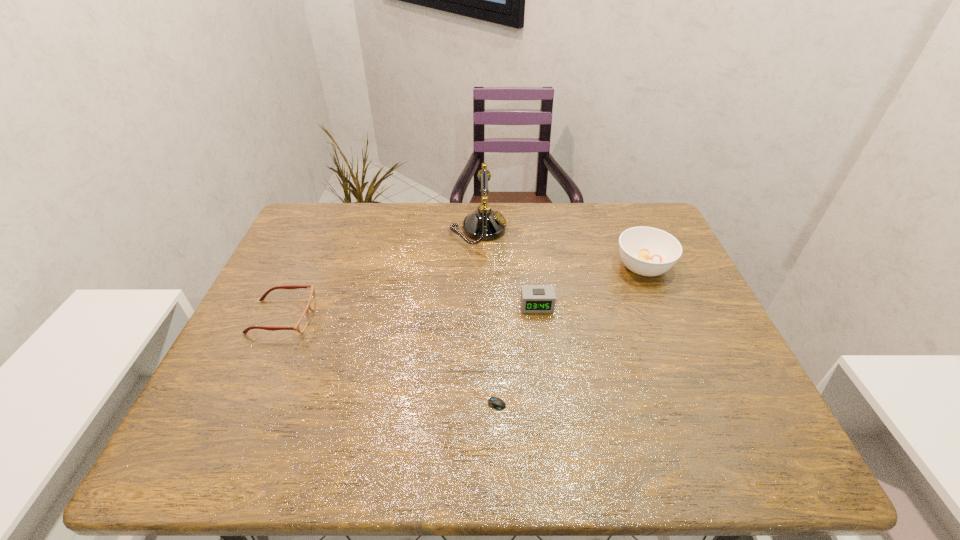
Where is `the tallest object`? the tallest object is located at coordinates 484,224.

This screenshot has width=960, height=540. Identify the location of the rightmost object. (647, 251).

Identify the location of the fourth shortest object. This screenshot has height=540, width=960. (647, 251).

You are a GUI agent. You are given a task and a screenshot of the screen. Output one action in this format:
    pyautogui.click(x=<x>, y=<y>)
    Task: Click on the alarm clock
    
    Given the screenshot: What is the action you would take?
    pyautogui.click(x=534, y=298)

Image resolution: width=960 pixels, height=540 pixels. Find the location of `the leftmost object`. the leftmost object is located at coordinates (301, 325).

I want to click on mouse, so click(x=497, y=403).

I want to click on the shortest object, so [497, 403].

The width and height of the screenshot is (960, 540). What are the coordinates of `vacant space located on the dial of the tallest object` in the screenshot? It's located at (579, 230).

Locate an element on the screen. The image size is (960, 540). vacant space located on the front of the second tallest object is located at coordinates (701, 404).

Locate an element on the screen. The height and width of the screenshot is (540, 960). free region located on the front-facing side of the fourth object from left to right is located at coordinates (542, 347).